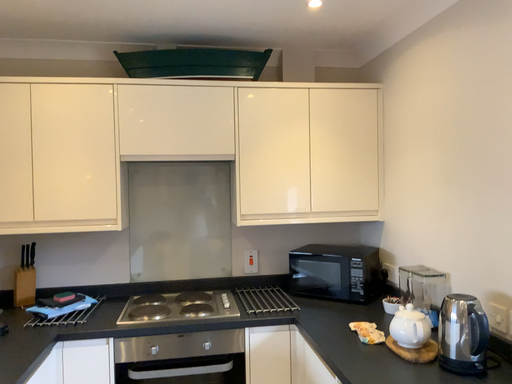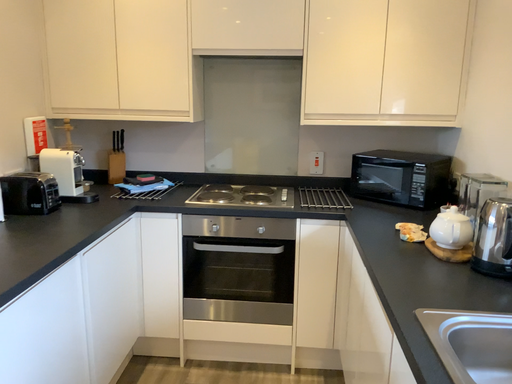
Question: How did the camera likely rotate when shooting the video?

Choices:
 (A) rotated right
 (B) rotated left

Answer: (B)